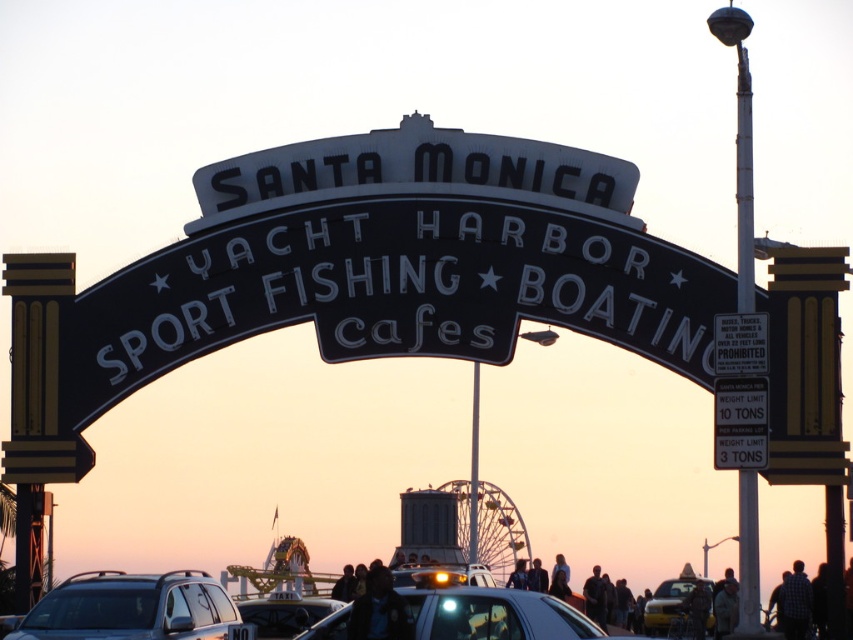
Does silver metallic suv at center appear under yellow matte taxi cab at center?

No, silver metallic suv at center is not below yellow matte taxi cab at center.

Consider the image. Between silver metallic suv at center and yellow matte taxi cab at center, which one is positioned lower?

yellow matte taxi cab at center is lower down.

Locate an element on the screen. This screenshot has height=640, width=853. silver metallic suv at center is located at coordinates 131,608.

Locate an element on the screen. The image size is (853, 640). silver metallic suv at center is located at coordinates (131, 608).

Between shiny silver car at center and matte black taxi at center, which one is positioned lower?

matte black taxi at center is below.

Does point (564, 612) lie in front of point (254, 614)?

Yes, point (564, 612) is in front of point (254, 614).

Where is `shiny silver car at center`? shiny silver car at center is located at coordinates (488, 614).

Based on the photo, is silver metallic suv at center to the left of matte black taxi at center from the viewer's perspective?

Correct, you'll find silver metallic suv at center to the left of matte black taxi at center.

Is silver metallic suv at center positioned behind matte black taxi at center?

No, silver metallic suv at center is in front of matte black taxi at center.

Between point (135, 582) and point (289, 602), which one is positioned behind?

The point (289, 602) is more distant.

At what (x,y) coordinates should I click in order to perform the action: click on silver metallic suv at center. Please return your answer as a coordinate pair (x, y). Looking at the image, I should click on (131, 608).